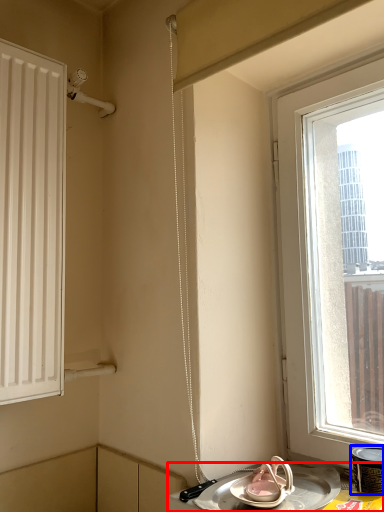
Question: Which point is closer to the camera, table (highlighted by a red box) or appliance (highlighted by a blue box)?

Choices:
 (A) table
 (B) appliance

Answer: (A)